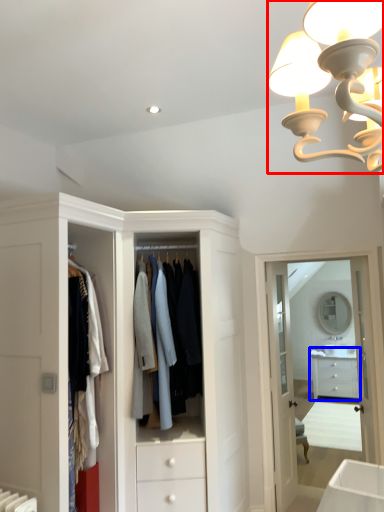
Question: Which point is closer to the camera, lamp (highlighted by a red box) or chest of drawers (highlighted by a blue box)?

Choices:
 (A) lamp
 (B) chest of drawers

Answer: (A)